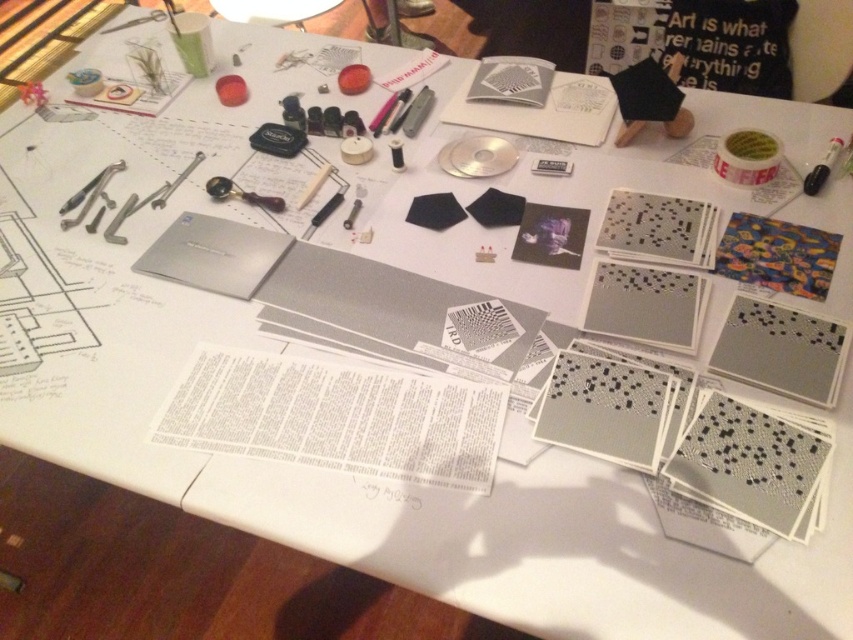
You need to place both the metallic silver wrench at left and the metallic silver pen at center into a drawer that can only accommodate items narrower than the pen. Which item cannot fit into the drawer?

The metallic silver wrench at left cannot fit into the drawer because its width is larger than the metallic silver pen at center, which the drawer can only accommodate items narrower than the pen.

You are a delivery robot with a height of 1.2 meters. You need to deliver a package to the point marked at point (834, 150) on the table. Can you reach the point without bending down?

The distance between point (834, 150) and the camera is 1.17 meters. Since the robot is 1.2 meters tall, it can reach the point without bending down as its height is slightly greater than the distance required.